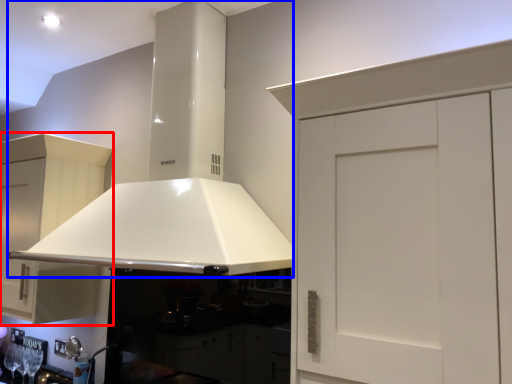
Question: Which point is further to the camera, cabinetry (highlighted by a red box) or exhaust hood (highlighted by a blue box)?

Choices:
 (A) cabinetry
 (B) exhaust hood

Answer: (A)